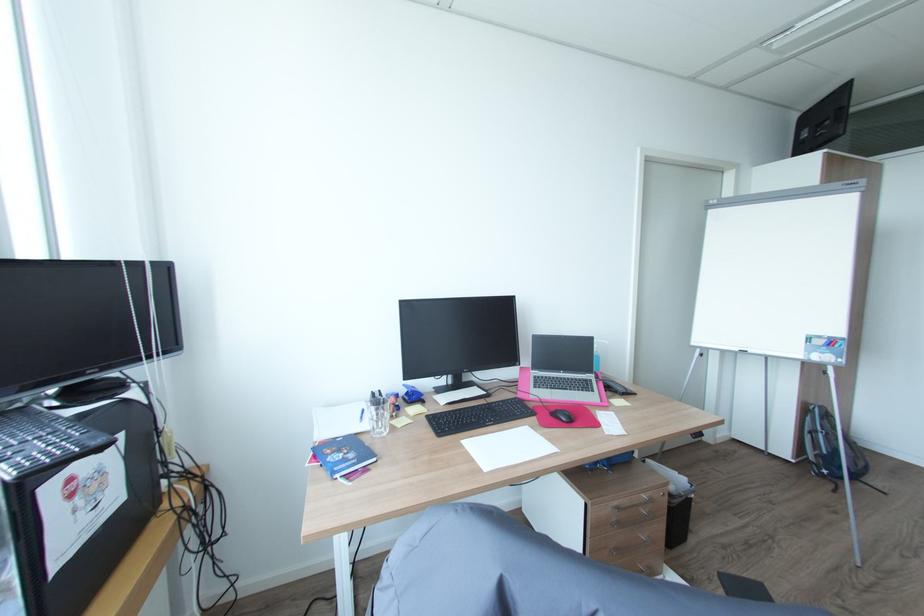
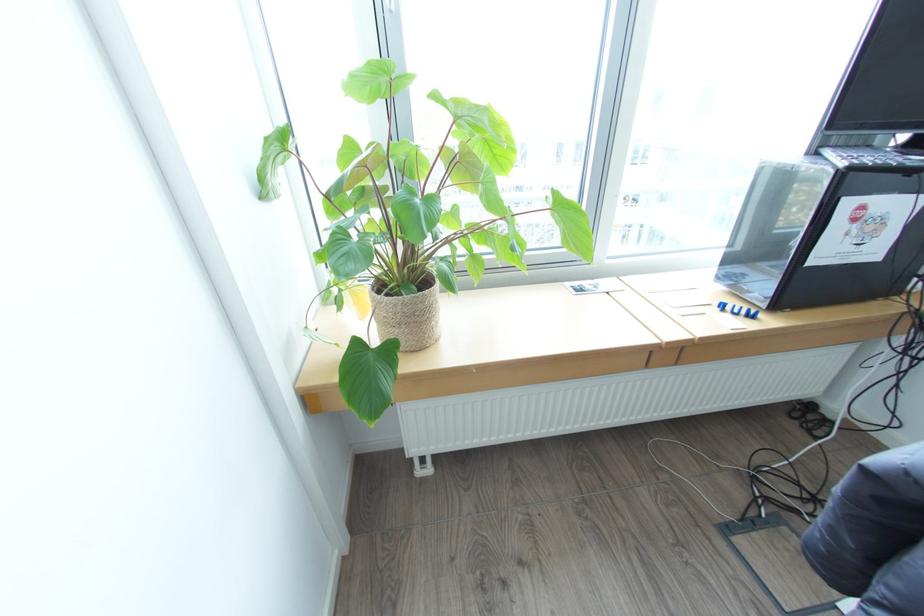
The images are taken continuously from a first-person perspective. In which direction is your viewpoint rotating?

The camera rotated toward left-down.